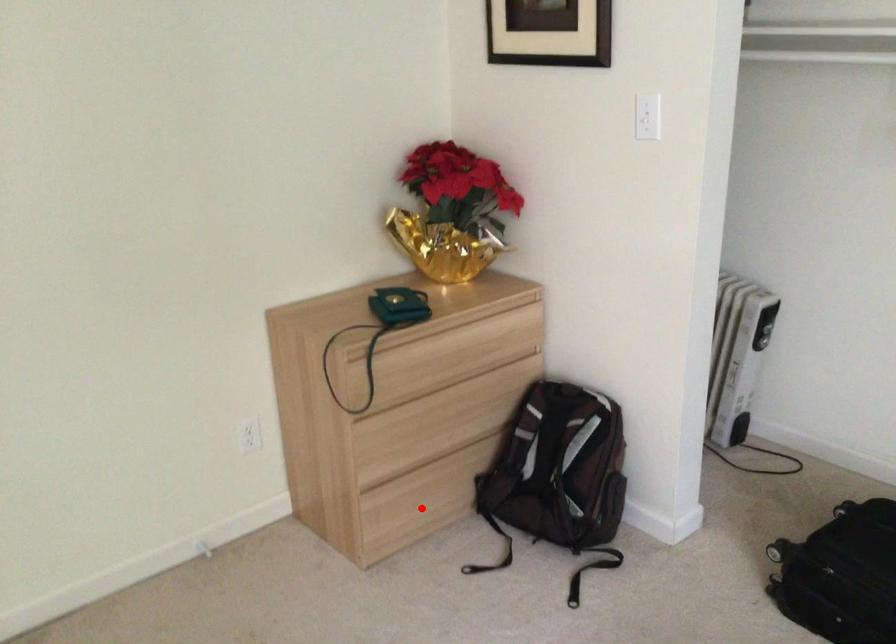
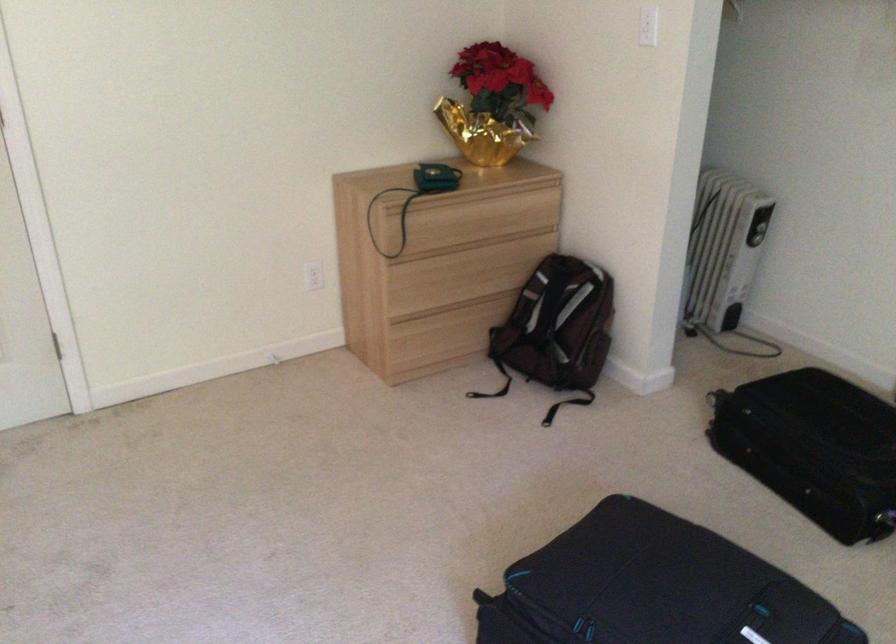
Question: A red point is marked in image1. In image2, is the corresponding 3D point closer to the camera or farther? Reply with the corresponding letter.

Choices:
 (A) The corresponding 3D point is closer.
 (B) The corresponding 3D point is farther.

Answer: (B)